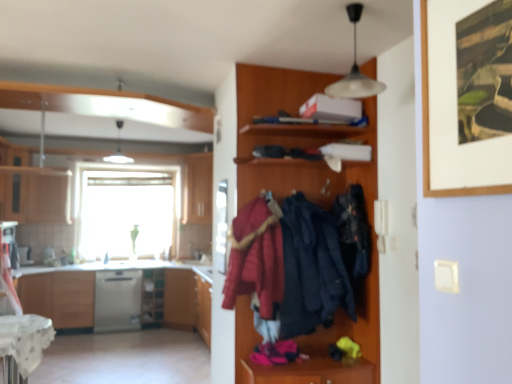
Question: Does matte wood cabinet at left, the second cabinetry when ordered from right to left, contain wooden shelf at lower left?

Choices:
 (A) yes
 (B) no

Answer: (B)

Question: From the image's perspective, would you say matte wood cabinet at left, the second cabinetry when ordered from right to left, is positioned over wooden shelf at lower left?

Choices:
 (A) no
 (B) yes

Answer: (B)

Question: Does matte wood cabinet at left, acting as the 2th cabinetry starting from the left, touch wooden shelf at lower left?

Choices:
 (A) no
 (B) yes

Answer: (A)

Question: Is matte wood cabinet at left, the second cabinetry when ordered from right to left, positioned behind wooden shelf at lower left?

Choices:
 (A) yes
 (B) no

Answer: (B)

Question: Is matte wood cabinet at left, the second cabinetry when ordered from right to left, smaller than wooden shelf at lower left?

Choices:
 (A) no
 (B) yes

Answer: (B)

Question: Looking at the image, does satin silver dishwasher at center seem bigger or smaller compared to wooden cabinet at center, acting as the third cabinetry starting from the left?

Choices:
 (A) big
 (B) small

Answer: (A)

Question: Considering the positions of satin silver dishwasher at center and wooden cabinet at center, acting as the third cabinetry starting from the left, in the image, is satin silver dishwasher at center wider or thinner than wooden cabinet at center, acting as the third cabinetry starting from the left,?

Choices:
 (A) wide
 (B) thin

Answer: (A)

Question: Is point (96, 291) positioned closer to the camera than point (210, 158)?

Choices:
 (A) farther
 (B) closer

Answer: (B)

Question: From the image's perspective, relative to wooden cabinet at center, acting as the first cabinetry starting from the right, is satin silver dishwasher at center above or below?

Choices:
 (A) below
 (B) above

Answer: (A)

Question: Considering the positions of point (262, 264) and point (286, 182), is point (262, 264) closer or farther from the camera than point (286, 182)?

Choices:
 (A) closer
 (B) farther

Answer: (A)

Question: Considering the positions of velvet red coat at center, acting as the 1th clothing starting from the left, and wooden coat rack at center in the image, is velvet red coat at center, acting as the 1th clothing starting from the left, bigger or smaller than wooden coat rack at center?

Choices:
 (A) small
 (B) big

Answer: (A)

Question: Is velvet red coat at center, acting as the 1th clothing starting from the left, taller or shorter than wooden coat rack at center?

Choices:
 (A) tall
 (B) short

Answer: (B)

Question: In terms of width, does velvet red coat at center, acting as the 1th clothing starting from the left, look wider or thinner when compared to wooden coat rack at center?

Choices:
 (A) wide
 (B) thin

Answer: (B)

Question: Is dark blue fabric coat at center, arranged as the 2th clothing when viewed from the right, wider or thinner than white matte pendant light at upper center?

Choices:
 (A) wide
 (B) thin

Answer: (A)

Question: Looking at the image, does dark blue fabric coat at center, arranged as the 2th clothing when viewed from the right, seem bigger or smaller compared to white matte pendant light at upper center?

Choices:
 (A) small
 (B) big

Answer: (B)